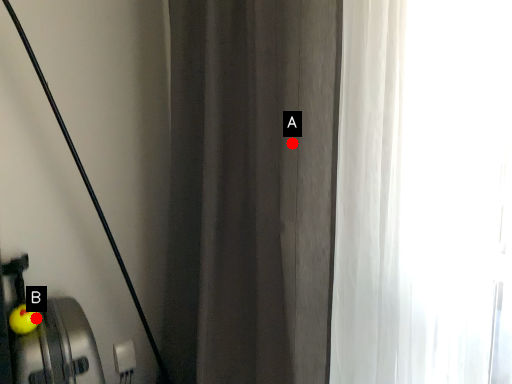
Question: Two points are circled on the image, labeled by A and B beside each circle. Among these points, which one is farthest from the camera?

Choices:
 (A) A is further
 (B) B is further

Answer: (B)